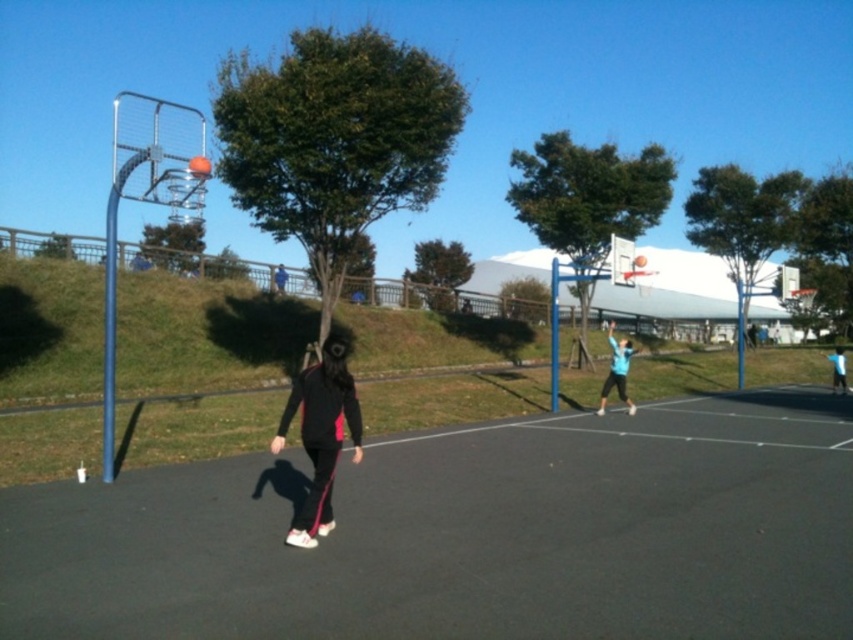
You are a photographer positioned at the edge of the basketball court. You need to capture a photo that includes both the blue fabric shirt at right and the black fabric jacket at center. Based on their positions, which direction should you move to ensure both subjects are in frame?

The blue fabric shirt at right is to the right of the black fabric jacket at center. To include both in the frame, move to the left so that the blue fabric shirt at right remains visible on the right side and the black fabric jacket at center stays centered.

You are a photographer standing on the basketball court and want to take a photo that includes both the black fabric court at center and the blue matte basketball player at upper right. Which object should you focus on first to ensure both are in the frame?

The black fabric court at center is located below the blue matte basketball player at upper right, so you should focus on the blue matte basketball player at upper right first to ensure both are in the frame.

What is the exact coordinate of the blue fabric shirt at right?

The blue fabric shirt at right is located at coordinate point (x=838, y=369).